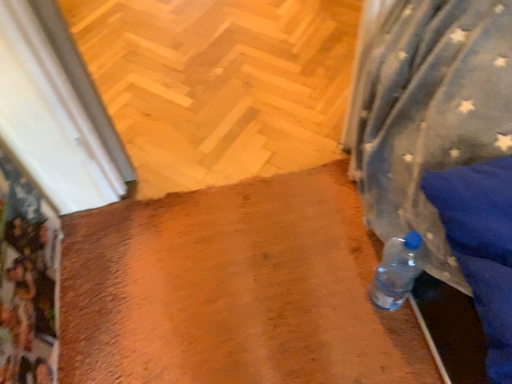
I want to click on vacant space situated above wooden floor at center (from a real-world perspective), so click(174, 72).